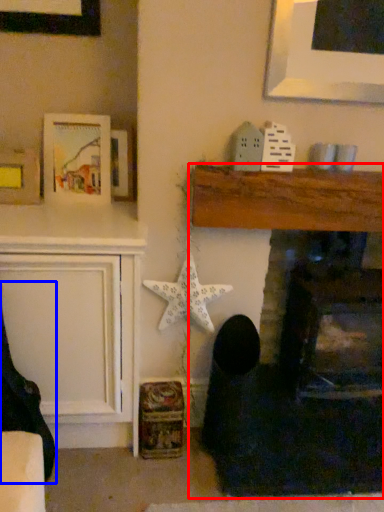
Question: Which of the following is the farthest to the observer, fireplace (highlighted by a red box) or rocking chair (highlighted by a blue box)?

Choices:
 (A) fireplace
 (B) rocking chair

Answer: (A)